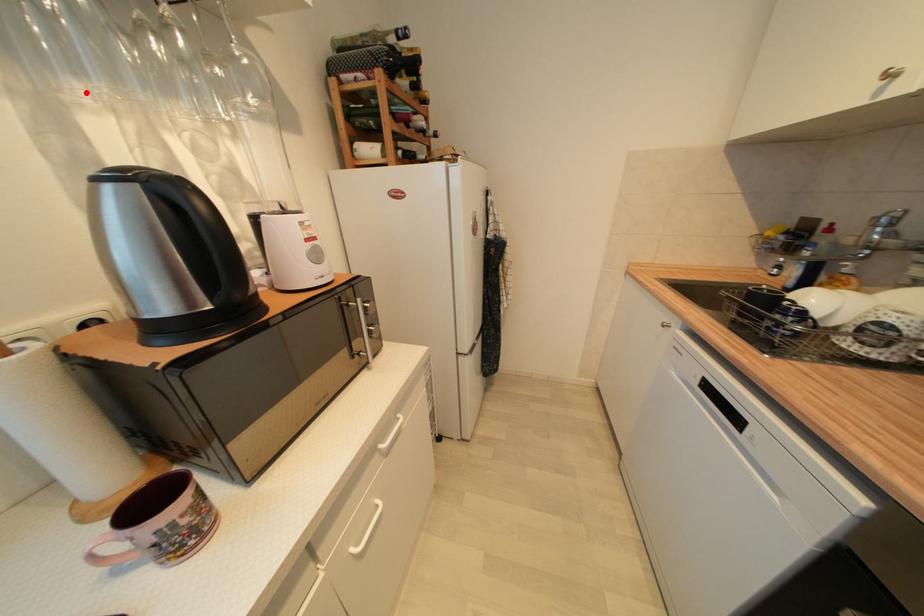
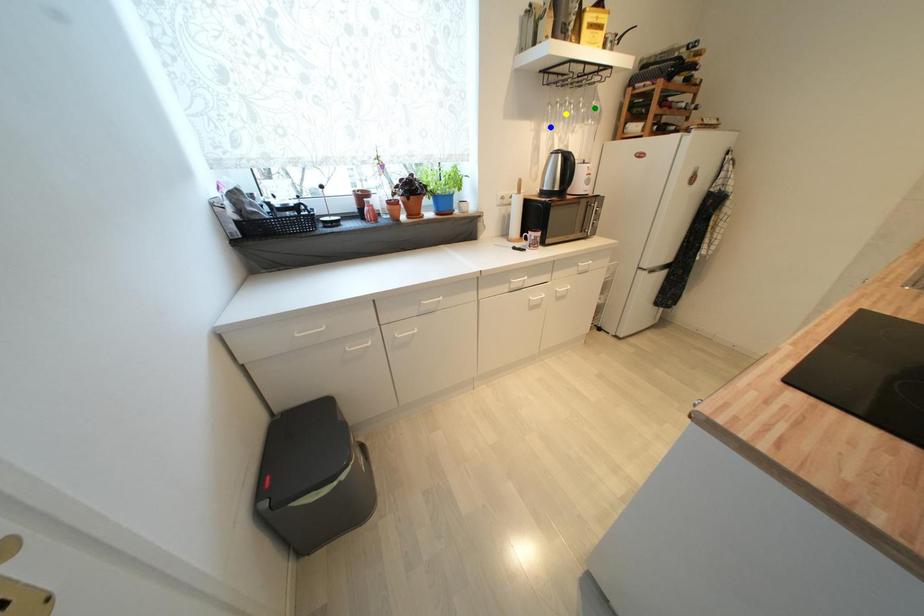
Question: I am providing you with two images of the same scene from different viewpoints. A red point is marked on the first image. You are given multiple points on the second image. Which spot in image 2 lines up with the point in image 1?

Choices:
 (A) green point
 (B) blue point
 (C) yellow point

Answer: (B)